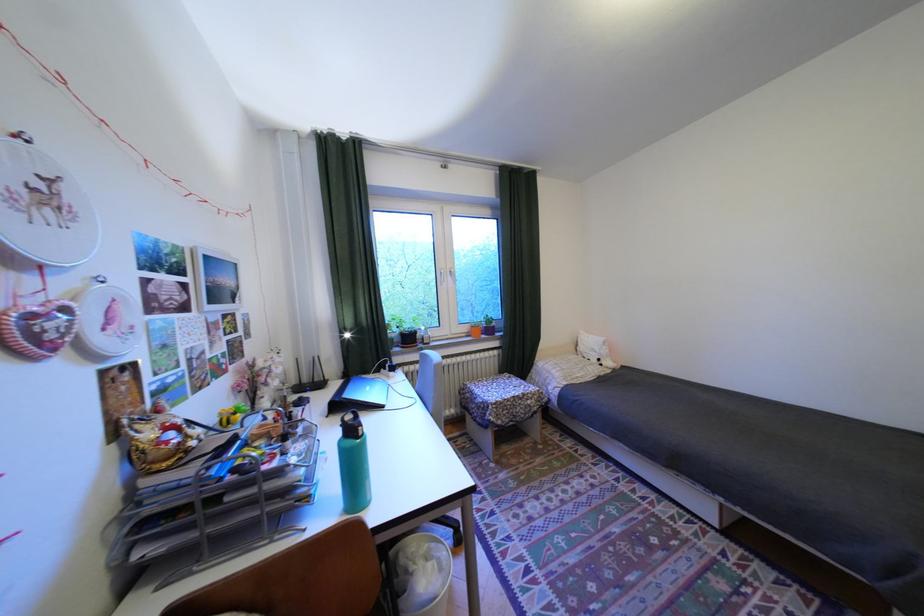
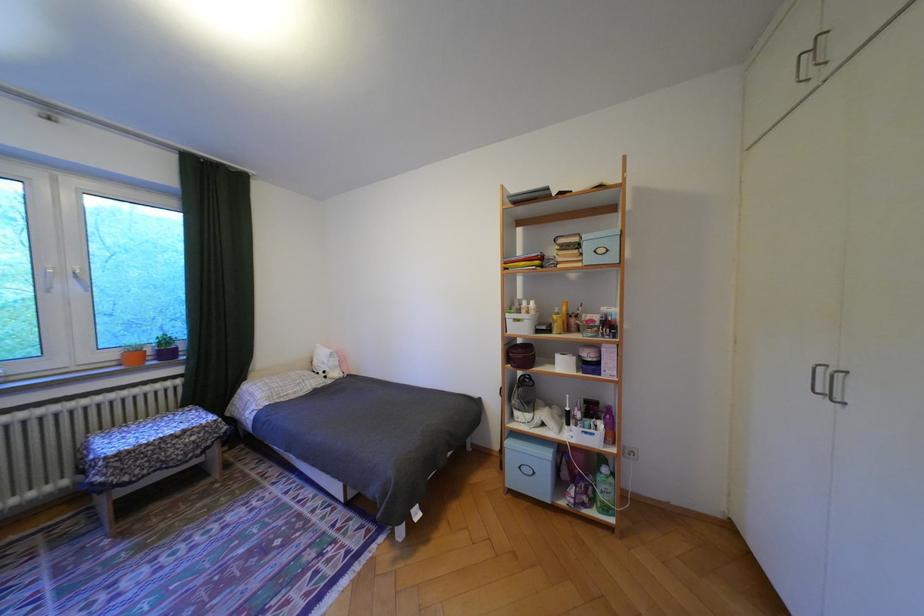
Locate, in the second image, the point that corresponds to [478,329] in the first image.

(124, 355)